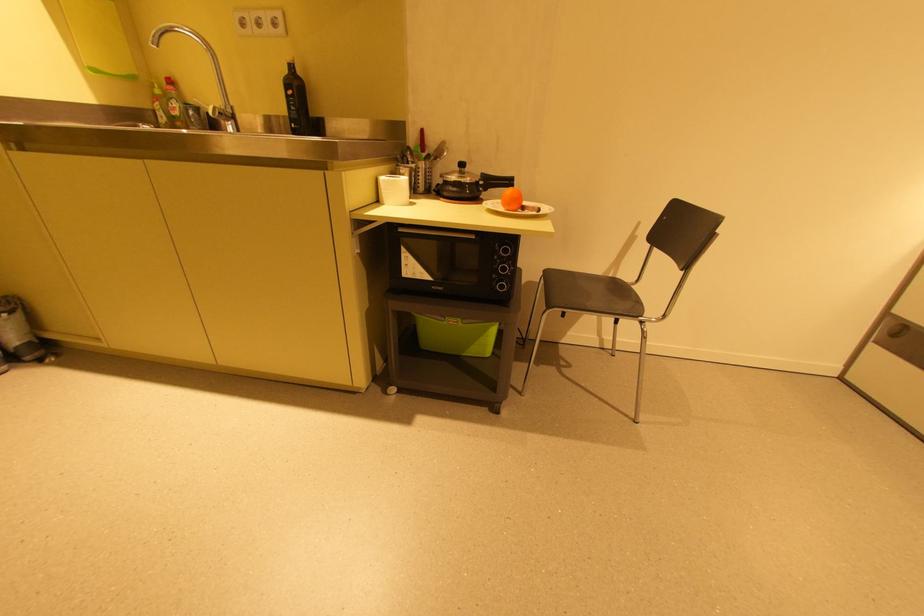
This screenshot has height=616, width=924. In order to click on red spatula handle in this screenshot , I will do point(421,140).